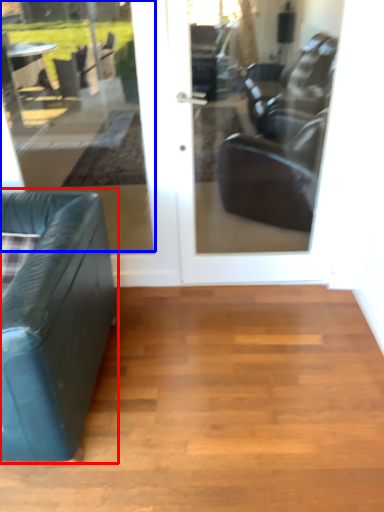
Question: Which object is closer to the camera taking this photo, studio couch (highlighted by a red box) or window (highlighted by a blue box)?

Choices:
 (A) studio couch
 (B) window

Answer: (A)